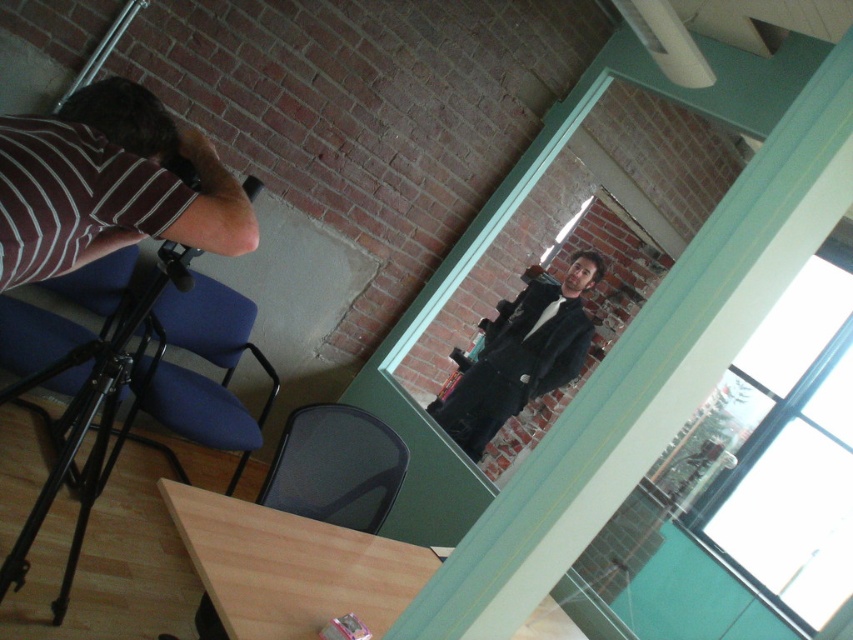
Consider the image. Who is more forward, [218,246] or [538,291]?

Point [218,246] is more forward.

Does striped fabric shirt at left have a smaller size compared to black matte jacket at center?

Indeed, striped fabric shirt at left has a smaller size compared to black matte jacket at center.

The image size is (853, 640). What are the coordinates of `striped fabric shirt at left` in the screenshot? It's located at (109, 184).

Between light wood table at lower center and black metal tripod at lower left, which one is positioned higher?

Positioned higher is black metal tripod at lower left.

Is light wood table at lower center shorter than black metal tripod at lower left?

Yes.

Image resolution: width=853 pixels, height=640 pixels. I want to click on light wood table at lower center, so click(x=289, y=566).

Describe the element at coordinates (521, 355) in the screenshot. I see `black matte jacket at center` at that location.

Who is taller, black matte jacket at center or black metal tripod at lower left?

Standing taller between the two is black matte jacket at center.

Is point (548, 307) positioned behind point (97, 349)?

That is True.

The width and height of the screenshot is (853, 640). What are the coordinates of `black matte jacket at center` in the screenshot? It's located at (521, 355).